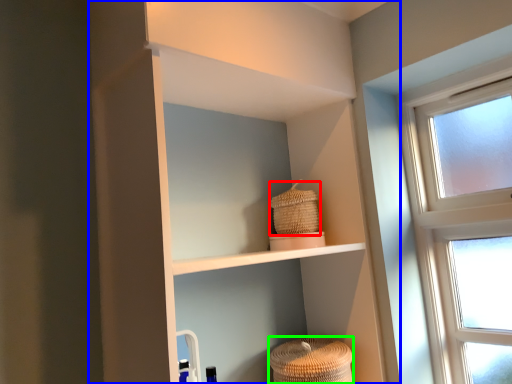
Question: Which object is positioned farthest from basket (highlighted by a red box)? Select from shelf (highlighted by a blue box) and basket (highlighted by a green box).

Choices:
 (A) shelf
 (B) basket

Answer: (A)